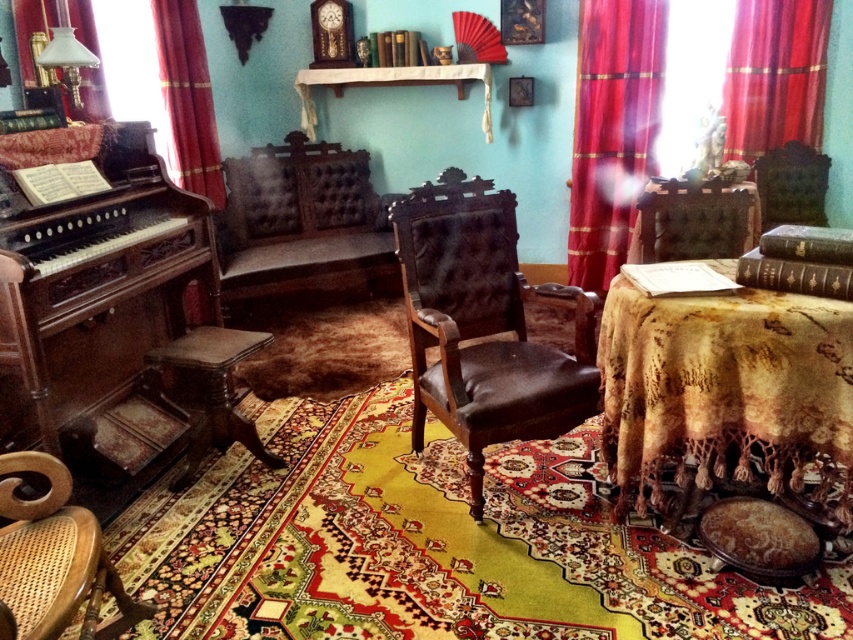
Find the location of a particular element. woven cane armchair at lower left is located at coordinates (53, 560).

I want to click on woven cane armchair at lower left, so pos(53,560).

Which is more to the right, polished dark wood piano at left or red velvet curtain at right?

red velvet curtain at right

Who is positioned more to the left, polished dark wood piano at left or red velvet curtain at right?

From the viewer's perspective, polished dark wood piano at left appears more on the left side.

Does point (45, 298) come closer to viewer compared to point (579, 54)?

Yes, point (45, 298) is in front of point (579, 54).

Image resolution: width=853 pixels, height=640 pixels. What are the coordinates of `polished dark wood piano at left` in the screenshot? It's located at (102, 308).

Can you confirm if woven cane armchair at lower left is positioned to the right of red velvet curtain at left?

Correct, you'll find woven cane armchair at lower left to the right of red velvet curtain at left.

Describe the element at coordinates (53, 560) in the screenshot. Image resolution: width=853 pixels, height=640 pixels. I see `woven cane armchair at lower left` at that location.

Is point (56, 586) positioned behind point (166, 58)?

No, (56, 586) is in front of (166, 58).

Locate an element on the screen. Image resolution: width=853 pixels, height=640 pixels. woven cane armchair at lower left is located at coordinates (53, 560).